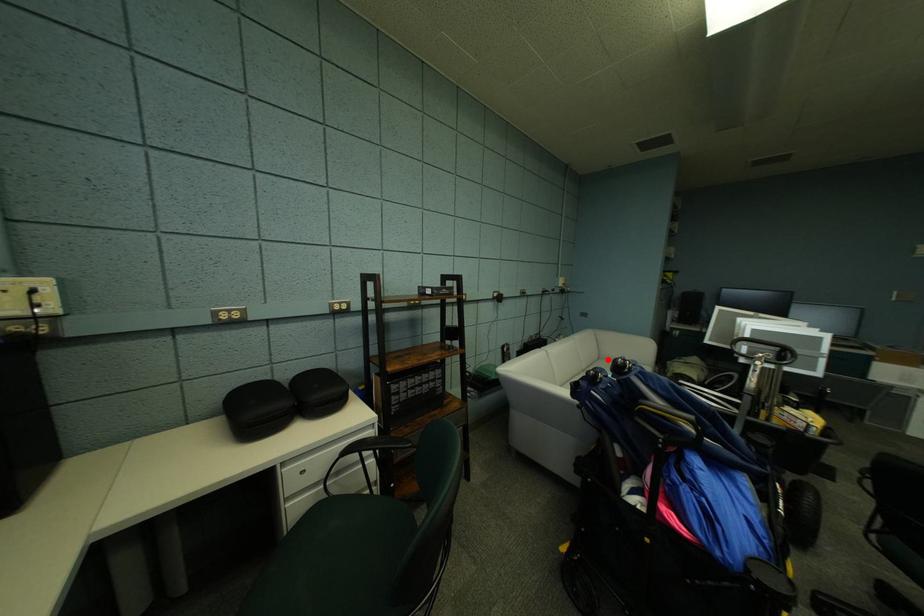
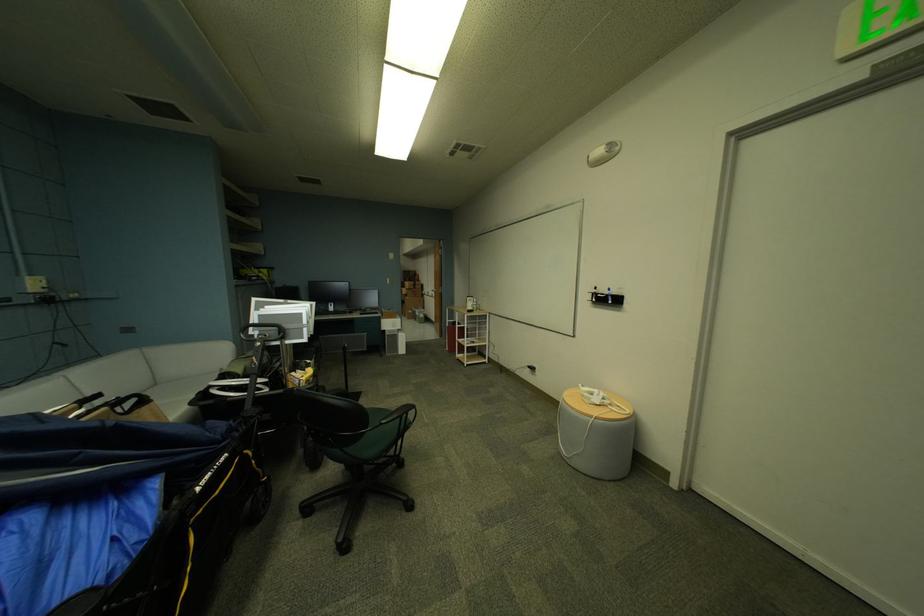
The point at the highlighted location is marked in the first image. Where is the corresponding point in the second image?

(164, 386)